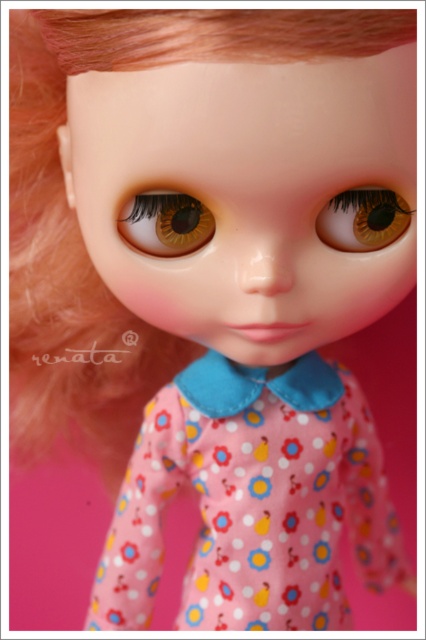
Question: Where is pink fabric dress at center located in relation to brown glossy eye at center in the image?

Choices:
 (A) above
 (B) below

Answer: (B)

Question: Which of the following is the farthest from the observer?

Choices:
 (A) brown matte eye at center
 (B) brown glossy eye at center

Answer: (B)

Question: Does pink fabric dress at center have a smaller size compared to brown matte eye at center?

Choices:
 (A) yes
 (B) no

Answer: (B)

Question: Estimate the real-world distances between objects in this image. Which object is closer to the brown glossy eye at center?

Choices:
 (A) pink fabric dress at center
 (B) brown matte eye at center

Answer: (B)

Question: Is brown matte eye at center smaller than brown glossy eye at center?

Choices:
 (A) yes
 (B) no

Answer: (A)

Question: Which object is the closest to the brown glossy eye at center?

Choices:
 (A) pink fabric dress at center
 (B) brown matte eye at center

Answer: (B)